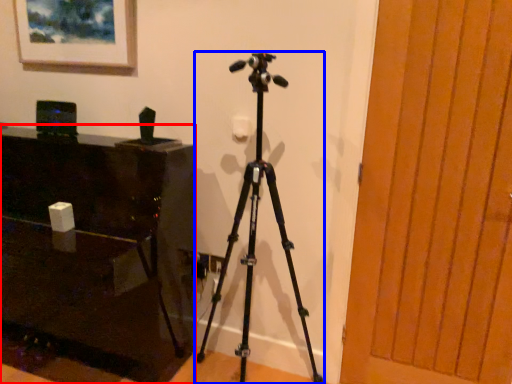
Question: Which point is further to the camera, furniture (highlighted by a red box) or tripod (highlighted by a blue box)?

Choices:
 (A) furniture
 (B) tripod

Answer: (A)